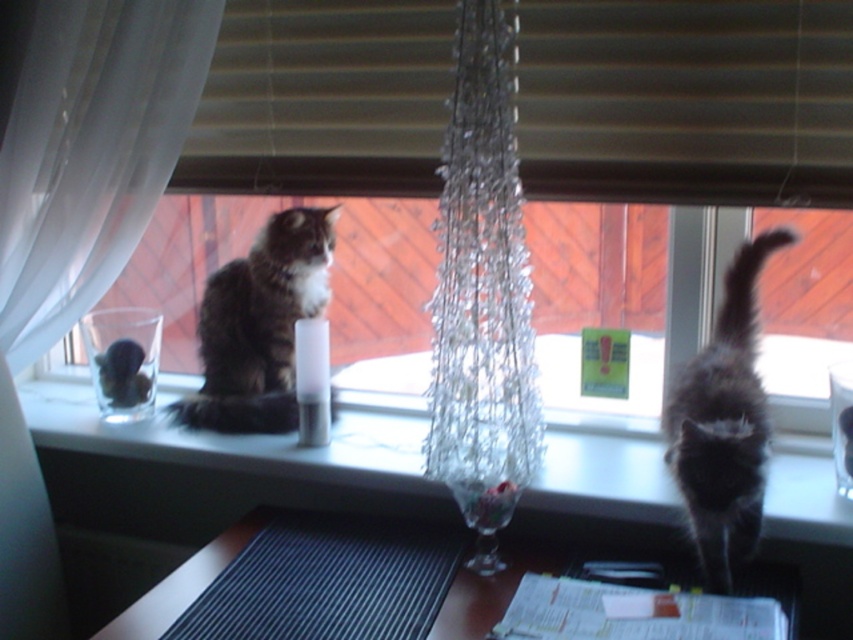
You are a small toy mouse that is 1 inch long. You want to move from the clear glass candle at center to the brown wooden blind at upper center. Can you fit through the space between them?

The distance between the clear glass candle at center and the brown wooden blind at upper center is 0.68 inches, which is narrower than the 1 inch length of the toy mouse. Therefore, the mouse cannot fit through the space between them.

You are taking a photo of two points in the scene. The first point is at coordinate point (537,10) and the second point is at coordinate point (311,12). Which point will appear larger in your photo?

Point (537,10) is closer to the camera than point (311,12), so it will appear larger in the photo.

Looking at this image, you are trying to decide whether to hang a new decorative item on the brown wooden blind at upper center or the white sheer curtain at upper left. Based on their sizes, which one can accommodate a wider decoration?

The brown wooden blind at upper center can accommodate a wider decoration because its width is larger than the white sheer curtain at upper left.